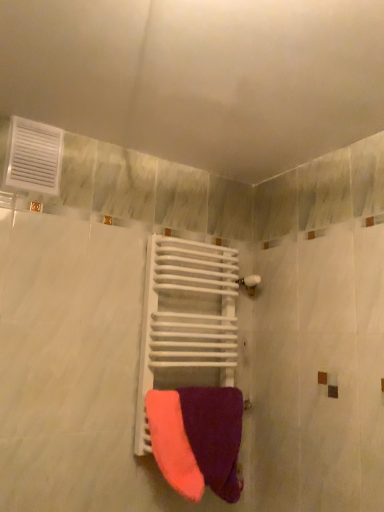
Identify the location of white plastic vent at upper left. (34, 156).

What do you see at coordinates (186, 321) in the screenshot? This screenshot has width=384, height=512. I see `white matte towel rack at center` at bounding box center [186, 321].

I want to click on purple soft towel at center, so click(197, 439).

Which is nearer, (x=193, y=402) or (x=230, y=248)?

The point (x=193, y=402) is in front.

From a real-world perspective, which is physically below, purple soft towel at center or white matte towel rack at center?

purple soft towel at center.

Based on the photo, is purple soft towel at center positioned with its back to white matte towel rack at center?

Yes, purple soft towel at center is facing away from white matte towel rack at center.

Where is `balustrade behind the purple soft towel at center`? Image resolution: width=384 pixels, height=512 pixels. balustrade behind the purple soft towel at center is located at coordinates (186, 321).

Would you say white plastic vent at upper left is a long distance from white matte towel rack at center?

No, there isn't a large distance between white plastic vent at upper left and white matte towel rack at center.

From a real-world perspective, between white plastic vent at upper left and white matte towel rack at center, who is vertically higher?

white plastic vent at upper left.

Consider the image. Is white plastic vent at upper left inside or outside of white matte towel rack at center?

white plastic vent at upper left is not enclosed by white matte towel rack at center.

Which object is positioned more to the right, white plastic vent at upper left or white matte towel rack at center?

white matte towel rack at center.

From the image's perspective, is white matte towel rack at center located above purple soft towel at center?

Yes, from the image's perspective, white matte towel rack at center is over purple soft towel at center.

Identify the location of towel on the right of white matte towel rack at center. (197, 439).

Between white matte towel rack at center and purple soft towel at center, which one has less height?

purple soft towel at center.

Between point (180, 285) and point (236, 412), which one is positioned behind?

The point (180, 285) is farther.

Which object is positioned more to the left, purple soft towel at center or white plastic vent at upper left?

From the viewer's perspective, white plastic vent at upper left appears more on the left side.

Considering the relative sizes of purple soft towel at center and white plastic vent at upper left in the image provided, is purple soft towel at center thinner than white plastic vent at upper left?

In fact, purple soft towel at center might be wider than white plastic vent at upper left.

Locate an element on the screen. The height and width of the screenshot is (512, 384). air conditioning that appears on the left of purple soft towel at center is located at coordinates (34, 156).

Measure the distance between white matte towel rack at center and white plastic vent at upper left.

The distance of white matte towel rack at center from white plastic vent at upper left is 25.04 inches.

Is white matte towel rack at center with white plastic vent at upper left?

They are not placed beside each other.

Between white matte towel rack at center and white plastic vent at upper left, which one is positioned in front?

Positioned in front is white plastic vent at upper left.

Which of these two, white plastic vent at upper left or purple soft towel at center, stands shorter?

Standing shorter between the two is white plastic vent at upper left.

Which point is more distant from viewer, (50, 149) or (193, 426)?

Point (50, 149)

Can you confirm if white plastic vent at upper left is positioned to the left of purple soft towel at center?

Correct, you'll find white plastic vent at upper left to the left of purple soft towel at center.

Between white plastic vent at upper left and purple soft towel at center, which one has smaller width?

Thinner between the two is white plastic vent at upper left.

What are the coordinates of `balustrade above the purple soft towel at center (from a real-world perspective)` in the screenshot? It's located at (186, 321).

I want to click on air conditioning above the white matte towel rack at center (from the image's perspective), so click(x=34, y=156).

From the image, which object appears to be farther from white plastic vent at upper left, purple soft towel at center or white matte towel rack at center?

Based on the image, purple soft towel at center appears to be further to white plastic vent at upper left.

Based on their spatial positions, is white matte towel rack at center or purple soft towel at center closer to white plastic vent at upper left?

white matte towel rack at center.

Considering their positions, is white matte towel rack at center positioned closer to purple soft towel at center than white plastic vent at upper left?

white matte towel rack at center is closer to purple soft towel at center.

Which object lies further to the anchor point white matte towel rack at center, purple soft towel at center or white plastic vent at upper left?

The object further to white matte towel rack at center is white plastic vent at upper left.

From the image, which object appears to be nearer to purple soft towel at center, white plastic vent at upper left or white matte towel rack at center?

Based on the image, white matte towel rack at center appears to be nearer to purple soft towel at center.

From the image, which object appears to be nearer to white matte towel rack at center, white plastic vent at upper left or purple soft towel at center?

Based on the image, purple soft towel at center appears to be nearer to white matte towel rack at center.

Where is `balustrade that lies between white plastic vent at upper left and purple soft towel at center from top to bottom`? balustrade that lies between white plastic vent at upper left and purple soft towel at center from top to bottom is located at coordinates (186, 321).